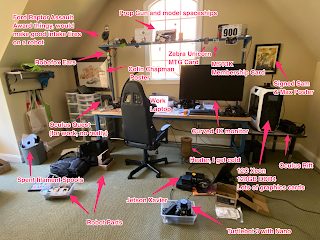
Find the location of a particular element. This screenshot has width=320, height=240. computer keyboard is located at coordinates (207, 111).